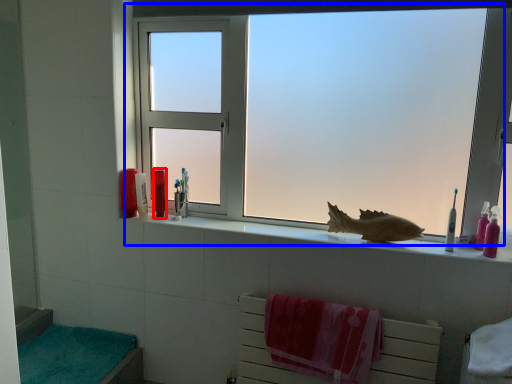
Question: Which object is closer to the camera taking this photo, toiletry (highlighted by a red box) or window (highlighted by a blue box)?

Choices:
 (A) toiletry
 (B) window

Answer: (B)